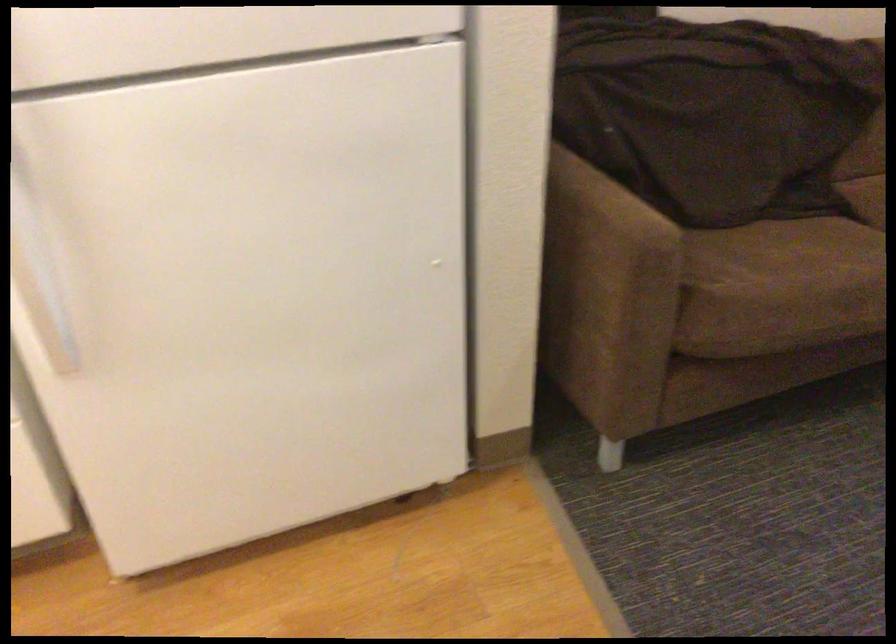
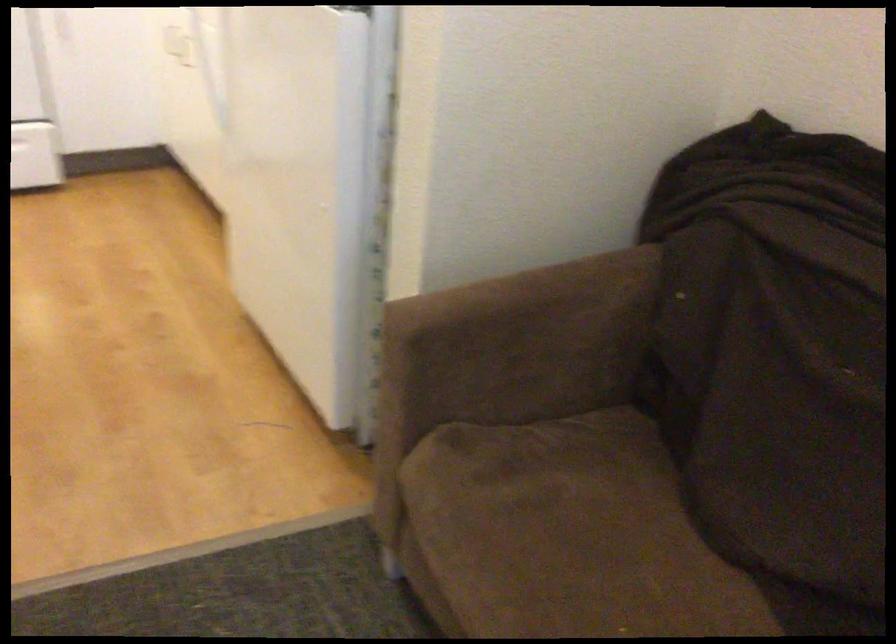
In the second image, find the point that corresponds to (x=754, y=269) in the first image.

(563, 542)